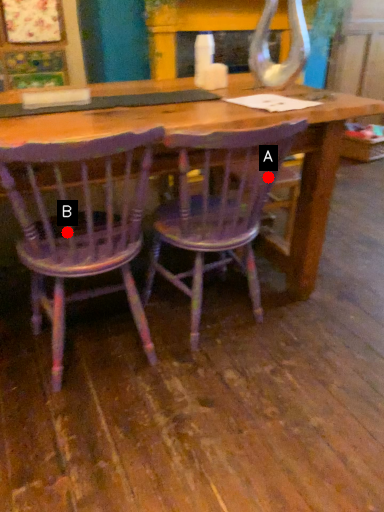
Question: Two points are circled on the image, labeled by A and B beside each circle. Which point is closer to the camera taking this photo?

Choices:
 (A) A is closer
 (B) B is closer

Answer: (B)